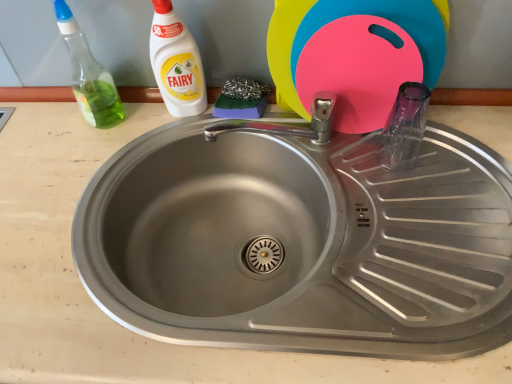
The height and width of the screenshot is (384, 512). What are the coordinates of `vacant area in front of green translucent spray bottle at left, marked as the second cleaning product in a right-to-left arrangement` in the screenshot? It's located at (83, 166).